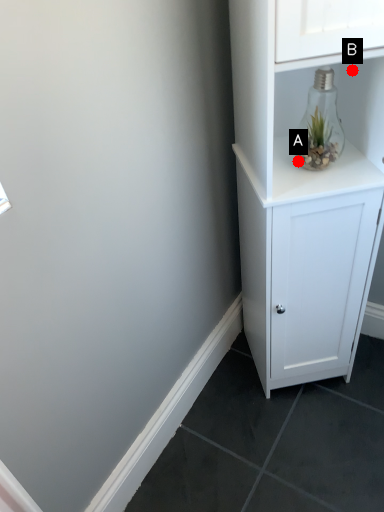
Question: Two points are circled on the image, labeled by A and B beside each circle. Which of the following is the closest to the observer?

Choices:
 (A) A is closer
 (B) B is closer

Answer: (B)